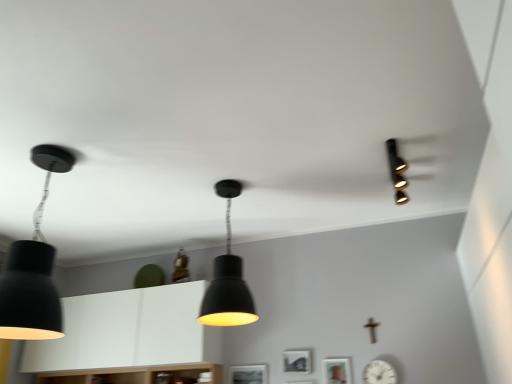
Question: Is the depth of matte black picture frame at center, positioned as the 1th picture frame in left-to-right order, greater than that of wooden picture frame at lower center, which is the third picture frame from left to right?

Choices:
 (A) no
 (B) yes

Answer: (B)

Question: From a real-world perspective, does matte black picture frame at center, the third picture frame in the right-to-left sequence, sit lower than wooden picture frame at lower center, the 1th picture frame positioned from the right?

Choices:
 (A) no
 (B) yes

Answer: (A)

Question: Is matte black picture frame at center, the third picture frame in the right-to-left sequence, outside of wooden picture frame at lower center, the 1th picture frame positioned from the right?

Choices:
 (A) yes
 (B) no

Answer: (A)

Question: Considering the relative sizes of matte black picture frame at center, positioned as the 1th picture frame in left-to-right order, and wooden picture frame at lower center, the 1th picture frame positioned from the right, in the image provided, is matte black picture frame at center, positioned as the 1th picture frame in left-to-right order, shorter than wooden picture frame at lower center, the 1th picture frame positioned from the right,?

Choices:
 (A) yes
 (B) no

Answer: (A)

Question: Is matte black picture frame at center, the third picture frame in the right-to-left sequence, at the right side of wooden picture frame at lower center, which is the third picture frame from left to right?

Choices:
 (A) no
 (B) yes

Answer: (A)

Question: From the image's perspective, is matte black lampshade at center, which is the second lamp in right-to-left order, positioned above or below black matte picture frame at center, which appears as the 2th picture frame when viewed from the right?

Choices:
 (A) below
 (B) above

Answer: (B)

Question: Is matte black lampshade at center, which is the second lamp in right-to-left order, taller or shorter than black matte picture frame at center, placed as the 2th picture frame when sorted from left to right?

Choices:
 (A) short
 (B) tall

Answer: (B)

Question: From a real-world perspective, is matte black lampshade at center, which is the second lamp in right-to-left order, above or below black matte picture frame at center, which appears as the 2th picture frame when viewed from the right?

Choices:
 (A) below
 (B) above

Answer: (B)

Question: In terms of width, does matte black lampshade at center, which is the second lamp in right-to-left order, look wider or thinner when compared to black matte picture frame at center, which appears as the 2th picture frame when viewed from the right?

Choices:
 (A) wide
 (B) thin

Answer: (A)

Question: Is white matte cabinet at center in front of or behind matte black pendant light at left, the first lamp positioned from the left, in the image?

Choices:
 (A) behind
 (B) front

Answer: (A)

Question: Does point (167, 337) appear closer or farther from the camera than point (50, 261)?

Choices:
 (A) farther
 (B) closer

Answer: (A)

Question: From a real-world perspective, is white matte cabinet at center physically located above or below matte black pendant light at left, which is the third lamp in right-to-left order?

Choices:
 (A) above
 (B) below

Answer: (B)

Question: Considering the positions of white matte cabinet at center and matte black pendant light at left, which is the third lamp in right-to-left order, in the image, is white matte cabinet at center wider or thinner than matte black pendant light at left, which is the third lamp in right-to-left order,?

Choices:
 (A) wide
 (B) thin

Answer: (B)

Question: Relative to white matte cabinet at center, is matte black picture frame at center, the third picture frame in the right-to-left sequence, in front or behind?

Choices:
 (A) front
 (B) behind

Answer: (B)

Question: Looking at the image, does matte black picture frame at center, positioned as the 1th picture frame in left-to-right order, seem bigger or smaller compared to white matte cabinet at center?

Choices:
 (A) big
 (B) small

Answer: (B)